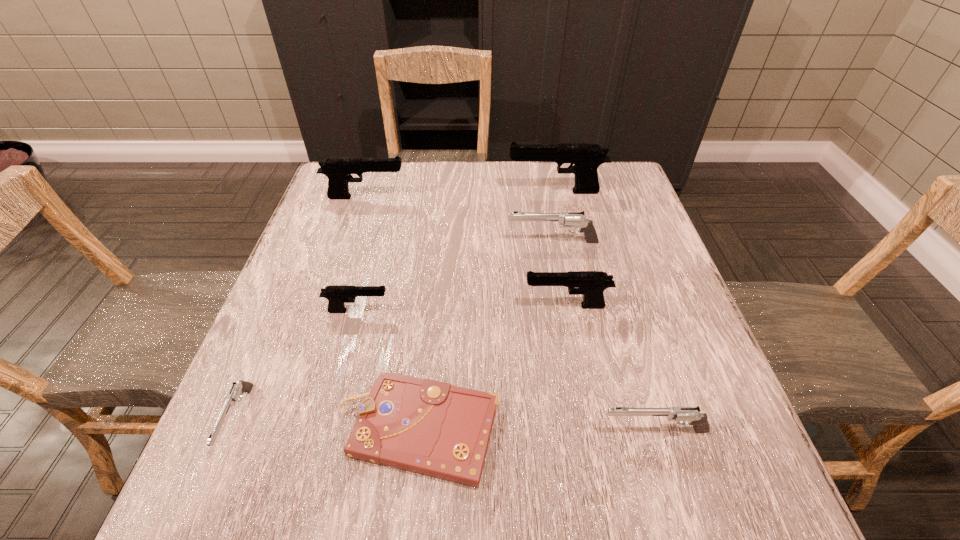
I want to click on the closest black pistol relative to the tallest object, so click(338, 170).

The width and height of the screenshot is (960, 540). In order to click on the second closest silver pistol to the third farthest pistol in this screenshot , I will do `click(239, 387)`.

Identify which silver pistol is located as the nearest to the biggest silver pistol. Please provide its 2D coordinates. Your answer should be formatted as a tuple, i.e. [(x, y)], where the tuple contains the x and y coordinates of a point satisfying the conditions above.

[(682, 415)]

Where is `vacant area that satisfies the following two spatial constraints: 1. on the front-facing side of the shortest object; 2. on the left side of the smallest silver pistol`? Image resolution: width=960 pixels, height=540 pixels. vacant area that satisfies the following two spatial constraints: 1. on the front-facing side of the shortest object; 2. on the left side of the smallest silver pistol is located at coordinates (233, 429).

Find the location of a particular element. The image size is (960, 540). vacant space that satisfies the following two spatial constraints: 1. on the front-facing side of the third smallest black pistol; 2. on the left side of the brown notebook is located at coordinates (292, 429).

What are the coordinates of `free region that satisfies the following two spatial constraints: 1. on the front-facing side of the biggest silver pistol; 2. on the front side of the brown notebook` in the screenshot? It's located at (586, 429).